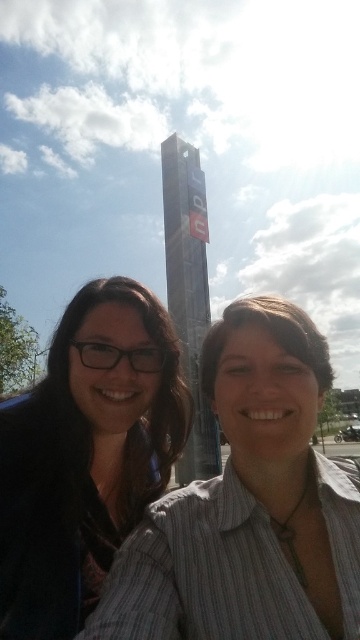
You are a photographer trying to capture a clear shot of the metallic glass tower at center. However, the matte black glasses at left are blocking your view. Can you estimate if the glasses are wider than the tower to determine if moving them might help?

The matte black glasses at left are wider than the metallic glass tower at center, so moving them could improve the view of the tower.